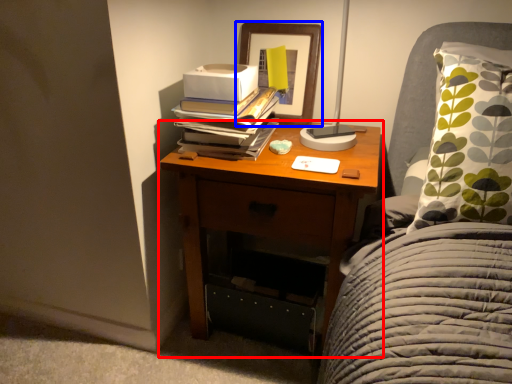
Question: Which of the following is the farthest to the observer, nightstand (highlighted by a red box) or picture frame (highlighted by a blue box)?

Choices:
 (A) nightstand
 (B) picture frame

Answer: (B)